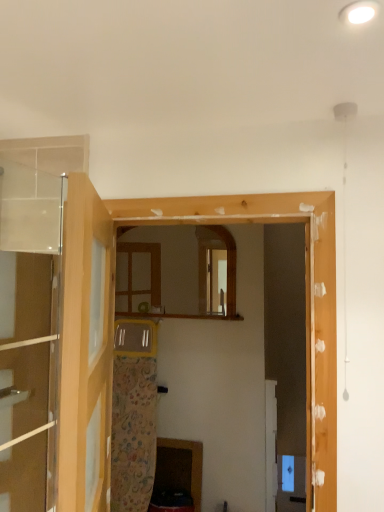
The height and width of the screenshot is (512, 384). What do you see at coordinates (86, 350) in the screenshot?
I see `clear glass door at upper left, the 2th door viewed from the left` at bounding box center [86, 350].

Locate an element on the screen. Image resolution: width=384 pixels, height=512 pixels. transparent glass door at left, which is the 1th door from left to right is located at coordinates (29, 334).

Locate an element on the screen. This screenshot has height=512, width=384. wooden mirror at center is located at coordinates (178, 270).

Find the location of `wooden cabinet at lower center`. wooden cabinet at lower center is located at coordinates (180, 467).

In order to face wooden cabinet at lower center, should I rotate leftwards or rightwards?

You should look left and rotate roughly 2.072 degrees.

Locate an element on the screen. This screenshot has height=512, width=384. clear glass door at upper left, the 2th door viewed from the left is located at coordinates pyautogui.click(x=86, y=350).

Between wooden cabinet at lower center and transparent glass door at left, which is the 1th door from left to right, which one has smaller size?

Smaller between the two is transparent glass door at left, which is the 1th door from left to right.

How far apart are wooden cabinet at lower center and transparent glass door at left, which is the 1th door from left to right?

A distance of 1.43 meters exists between wooden cabinet at lower center and transparent glass door at left, which is the 1th door from left to right.

From a real-world perspective, which is physically below, wooden cabinet at lower center or transparent glass door at left, which is the 1th door from left to right?

wooden cabinet at lower center.

Find the location of a particular element. This screenshot has width=384, height=512. cabinetry on the right of transparent glass door at left, the second door from the right is located at coordinates (180, 467).

From a real-world perspective, does transparent glass door at left, which is the 1th door from left to right, sit lower than wooden mirror at center?

Yes.

Looking at this image, from the image's perspective, which one is positioned lower, transparent glass door at left, which is the 1th door from left to right, or wooden mirror at center?

From the image's view, transparent glass door at left, which is the 1th door from left to right, is below.

Which point is more forward, (53,333) or (155,276)?

The point (53,333) is in front.

From the image's perspective, starting from the wooden mirror at center, which door is the 1st one below? Please provide its 2D coordinates.

[(29, 334)]

Can you confirm if transparent glass door at left, the second door from the right, is taller than wooden cabinet at lower center?

Indeed, transparent glass door at left, the second door from the right, has a greater height compared to wooden cabinet at lower center.

Consider the image. Is transparent glass door at left, the second door from the right, in front of or behind wooden cabinet at lower center in the image?

transparent glass door at left, the second door from the right, is positioned closer to the viewer than wooden cabinet at lower center.

Is transparent glass door at left, which is the 1th door from left to right, to the right of wooden cabinet at lower center from the viewer's perspective?

In fact, transparent glass door at left, which is the 1th door from left to right, is to the left of wooden cabinet at lower center.

Is transparent glass door at left, which is the 1th door from left to right, facing away from wooden cabinet at lower center?

No, wooden cabinet at lower center is not at the back of transparent glass door at left, which is the 1th door from left to right.

Considering their positions, is wooden frame at center located in front of or behind clear glass door at upper left, the 2th door viewed from the left?

Visually, wooden frame at center is located behind clear glass door at upper left, the 2th door viewed from the left.

Is clear glass door at upper left, the 2th door viewed from the left, located within wooden frame at center?

No.

From a real-world perspective, is wooden frame at center physically located above or below clear glass door at upper left, the 2th door viewed from the left?

wooden frame at center is above clear glass door at upper left, the 2th door viewed from the left.

From the image's perspective, between wooden frame at center and clear glass door at upper left, the 2th door viewed from the left, who is located below?

From the image's view, wooden frame at center is below.

Does wooden mirror at center appear on the left side of wooden cabinet at lower center?

Yes, wooden mirror at center is to the left of wooden cabinet at lower center.

How far apart are wooden mirror at center and wooden cabinet at lower center?

The distance of wooden mirror at center from wooden cabinet at lower center is 3.52 feet.

Image resolution: width=384 pixels, height=512 pixels. I want to click on cabinetry below the wooden mirror at center (from the image's perspective), so click(x=180, y=467).

In the scene shown: Choose the correct answer: Is transparent glass door at left, the second door from the right, inside clear glass door at upper left, placed as the first door when sorted from right to left, or outside it?

transparent glass door at left, the second door from the right, cannot be found inside clear glass door at upper left, placed as the first door when sorted from right to left.

Is transparent glass door at left, which is the 1th door from left to right, to the right of clear glass door at upper left, placed as the first door when sorted from right to left, from the viewer's perspective?

In fact, transparent glass door at left, which is the 1th door from left to right, is to the left of clear glass door at upper left, placed as the first door when sorted from right to left.

Is the depth of transparent glass door at left, which is the 1th door from left to right, greater than that of clear glass door at upper left, placed as the first door when sorted from right to left?

Yes, it is.

Is the depth of wooden mirror at center less than that of clear glass door at upper left, the 2th door viewed from the left?

No.

Which is behind, point (200, 267) or point (88, 487)?

The point (200, 267) is behind.

From the image's perspective, which one is positioned lower, wooden mirror at center or clear glass door at upper left, the 2th door viewed from the left?

clear glass door at upper left, the 2th door viewed from the left, appears lower in the image.

Image resolution: width=384 pixels, height=512 pixels. I want to click on the 2nd door to the left when counting from the wooden cabinet at lower center, so click(29, 334).

You are a GUI agent. You are given a task and a screenshot of the screen. Output one action in this format:
    pyautogui.click(x=<x>, y=<y>)
    Task: Click on the mirror on the right side of transparent glass door at left, which is the 1th door from left to right
    The image size is (384, 512).
    Given the screenshot: What is the action you would take?
    pyautogui.click(x=178, y=270)

From the image, which object appears to be farther from wooden mirror at center, transparent glass door at left, which is the 1th door from left to right, or wooden frame at center?

Among the two, wooden frame at center is located further to wooden mirror at center.

When comparing their distances from clear glass door at upper left, placed as the first door when sorted from right to left, does transparent glass door at left, the second door from the right, or wooden mirror at center seem further?

wooden mirror at center lies further to clear glass door at upper left, placed as the first door when sorted from right to left, than the other object.

Based on the photo, from the image, which object appears to be nearer to clear glass door at upper left, placed as the first door when sorted from right to left, wooden cabinet at lower center or wooden frame at center?

wooden frame at center is closer to clear glass door at upper left, placed as the first door when sorted from right to left.

From the image, which object appears to be nearer to wooden cabinet at lower center, wooden frame at center or wooden mirror at center?

wooden mirror at center is positioned closer to the anchor wooden cabinet at lower center.

When comparing their distances from clear glass door at upper left, placed as the first door when sorted from right to left, does wooden frame at center or transparent glass door at left, which is the 1th door from left to right, seem closer?

wooden frame at center lies closer to clear glass door at upper left, placed as the first door when sorted from right to left, than the other object.

Considering their positions, is wooden frame at center positioned further to wooden mirror at center than wooden cabinet at lower center?

wooden frame at center.

Estimate the real-world distances between objects in this image. Which object is further from transparent glass door at left, the second door from the right, clear glass door at upper left, the 2th door viewed from the left, or wooden cabinet at lower center?

wooden cabinet at lower center is further to transparent glass door at left, the second door from the right.

Based on their spatial positions, is wooden mirror at center or transparent glass door at left, the second door from the right, further from wooden frame at center?

Based on the image, wooden mirror at center appears to be further to wooden frame at center.

Find the location of a particular element. This screenshot has height=512, width=384. window frame between clear glass door at upper left, the 2th door viewed from the left, and wooden cabinet at lower center, along the z-axis is located at coordinates (113, 319).

The height and width of the screenshot is (512, 384). Identify the location of mirror positioned between wooden frame at center and wooden cabinet at lower center from near to far. (178, 270).

I want to click on door between clear glass door at upper left, placed as the first door when sorted from right to left, and wooden cabinet at lower center in the front-back direction, so click(29, 334).

Find the location of a particular element. This screenshot has width=384, height=512. mirror between transparent glass door at left, the second door from the right, and wooden cabinet at lower center from front to back is located at coordinates click(x=178, y=270).